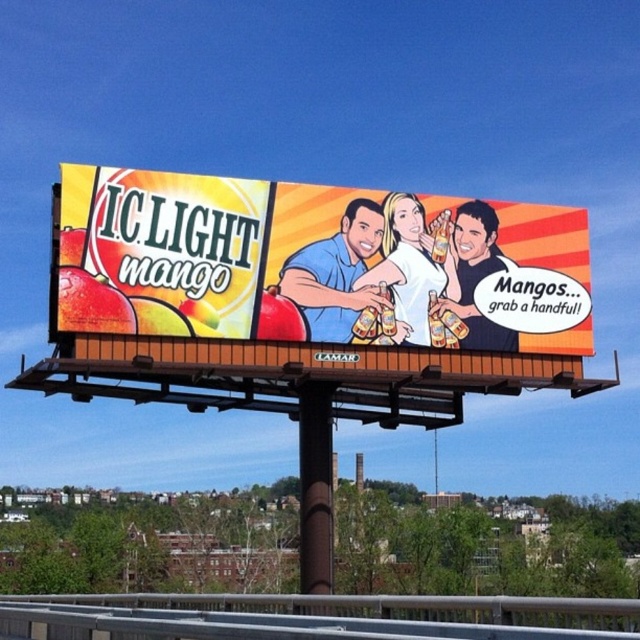
Question: Does smooth skin tone at center appear over smooth plastic beer bottle at center?

Choices:
 (A) no
 (B) yes

Answer: (B)

Question: Which point appears closest to the camera in this image?

Choices:
 (A) (460, 214)
 (B) (362, 294)
 (C) (408, 212)
 (D) (401, 234)

Answer: (B)

Question: Is matte yellow billboard at center wider than smooth skin man at center?

Choices:
 (A) no
 (B) yes

Answer: (B)

Question: Which point is closer to the camera?

Choices:
 (A) matte yellow billboard at center
 (B) smooth skin tone at center

Answer: (A)

Question: Does smooth skin man at center appear under smooth skin tone at center?

Choices:
 (A) yes
 (B) no

Answer: (A)

Question: Which of the following is the closest to the observer?

Choices:
 (A) (586, 259)
 (B) (451, 307)
 (C) (417, 212)
 (D) (355, 221)

Answer: (D)